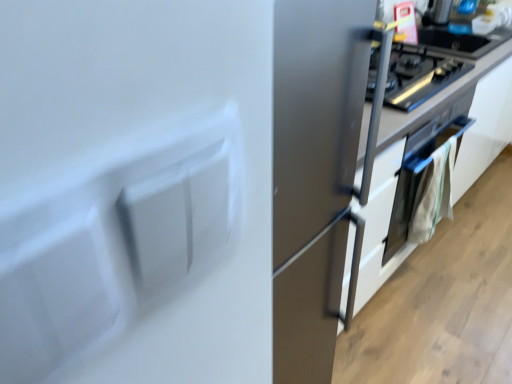
Describe the element at coordinates (418, 75) in the screenshot. This screenshot has height=384, width=512. I see `satin silver oven at upper right` at that location.

What is the approximate width of white matte refrigerator at center?

It is 33.46 centimeters.

This screenshot has height=384, width=512. Find the location of `satin silver oven at upper right`. satin silver oven at upper right is located at coordinates (418, 75).

Can you confirm if satin silver oven at upper right is taller than satin white cabinet at center?

Incorrect, the height of satin silver oven at upper right is not larger of that of satin white cabinet at center.

From the image's perspective, is satin silver oven at upper right on satin white cabinet at center?

Correct, satin silver oven at upper right appears higher than satin white cabinet at center in the image.

How many degrees apart are the facing directions of satin silver oven at upper right and satin white cabinet at center?

They differ by 0.683 degrees in their facing directions.

Which point is more forward, (424, 160) or (277, 294)?

The point (277, 294) is closer to the camera.

Is satin white cabinet at center at the back of satin silver oven at lower right?

That's right, satin silver oven at lower right is facing away from satin white cabinet at center.

In the scene shown: Can you confirm if satin silver oven at lower right is thinner than satin white cabinet at center?

Correct, the width of satin silver oven at lower right is less than that of satin white cabinet at center.

Consider the image. Considering the positions of objects satin silver oven at lower right and satin white cabinet at center in the image provided, who is more to the left, satin silver oven at lower right or satin white cabinet at center?

satin silver oven at lower right.

Is point (399, 215) positioned before point (278, 368)?

No.

Is satin silver oven at lower right facing towards white matte refrigerator at center?

No, satin silver oven at lower right is not aimed at white matte refrigerator at center.

Between satin silver oven at lower right and white matte refrigerator at center, which one appears on the left side from the viewer's perspective?

white matte refrigerator at center.

The width and height of the screenshot is (512, 384). I want to click on oven located on the left of satin white cabinet at center, so click(x=416, y=181).

Considering the sizes of satin white cabinet at center and satin silver oven at lower right in the image, is satin white cabinet at center wider or thinner than satin silver oven at lower right?

In the image, satin white cabinet at center appears to be wider than satin silver oven at lower right.

Considering the sizes of objects satin white cabinet at center and satin silver oven at lower right in the image provided, who is shorter, satin white cabinet at center or satin silver oven at lower right?

satin silver oven at lower right is shorter.

Which is more to the right, satin white cabinet at center or satin silver oven at lower right?

satin white cabinet at center is more to the right.

From the image's perspective, is satin white cabinet at center above white matte refrigerator at center?

Correct, satin white cabinet at center appears higher than white matte refrigerator at center in the image.

Is satin white cabinet at center bigger than white matte refrigerator at center?

Yes, satin white cabinet at center is bigger than white matte refrigerator at center.

Considering the relative positions of satin white cabinet at center and white matte refrigerator at center in the image provided, is satin white cabinet at center to the right of white matte refrigerator at center from the viewer's perspective?

Yes.

From the image's perspective, is white matte refrigerator at center positioned above or below satin white cabinet at center?

From the image's perspective, white matte refrigerator at center appears below satin white cabinet at center.

Which is more to the left, white matte refrigerator at center or satin white cabinet at center?

white matte refrigerator at center is more to the left.

Would you say white matte refrigerator at center contains satin white cabinet at center?

That's incorrect, satin white cabinet at center is not inside white matte refrigerator at center.

Could you tell me if satin silver oven at lower right is facing satin silver oven at upper right?

No, satin silver oven at lower right is not turned towards satin silver oven at upper right.

Does satin silver oven at lower right have a lesser width compared to satin silver oven at upper right?

Indeed, satin silver oven at lower right has a lesser width compared to satin silver oven at upper right.

Image resolution: width=512 pixels, height=384 pixels. Find the location of `home appliance located in front of the satin silver oven at lower right`. home appliance located in front of the satin silver oven at lower right is located at coordinates [x=418, y=75].

Looking at this image, do you think satin silver oven at lower right is within satin silver oven at upper right, or outside of it?

satin silver oven at lower right cannot be found inside satin silver oven at upper right.

I want to click on home appliance behind the satin white cabinet at center, so click(x=418, y=75).

Find the location of a particular element. cabinetry above the satin silver oven at lower right (from a real-world perspective) is located at coordinates (336, 173).

Estimate the real-world distances between objects in this image. Which object is closer to satin silver oven at lower right, white matte refrigerator at center or satin white cabinet at center?

Among the two, satin white cabinet at center is located nearer to satin silver oven at lower right.

Looking at the image, which one is located further to white matte refrigerator at center, satin silver oven at lower right or satin white cabinet at center?

satin silver oven at lower right.

Estimate the real-world distances between objects in this image. Which object is closer to satin silver oven at upper right, white matte refrigerator at center or satin silver oven at lower right?

satin silver oven at lower right.

From the image, which object appears to be nearer to satin silver oven at upper right, satin silver oven at lower right or white matte refrigerator at center?

satin silver oven at lower right is positioned closer to the anchor satin silver oven at upper right.

When comparing their distances from white matte refrigerator at center, does satin silver oven at upper right or satin silver oven at lower right seem further?

satin silver oven at lower right lies further to white matte refrigerator at center than the other object.

Estimate the real-world distances between objects in this image. Which object is further from satin silver oven at upper right, satin white cabinet at center or satin silver oven at lower right?

satin white cabinet at center lies further to satin silver oven at upper right than the other object.

In the scene shown: Based on their spatial positions, is satin silver oven at lower right or white matte refrigerator at center closer to satin white cabinet at center?

white matte refrigerator at center is positioned closer to the anchor satin white cabinet at center.

Considering their positions, is satin white cabinet at center positioned closer to white matte refrigerator at center than satin silver oven at lower right?

satin white cabinet at center is positioned closer to the anchor white matte refrigerator at center.

The width and height of the screenshot is (512, 384). Find the location of `cabinetry that lies between satin silver oven at upper right and satin silver oven at lower right from top to bottom`. cabinetry that lies between satin silver oven at upper right and satin silver oven at lower right from top to bottom is located at coordinates (336, 173).

At what (x,y) coordinates should I click in order to perform the action: click on cabinetry between white matte refrigerator at center and satin silver oven at lower right along the z-axis. Please return your answer as a coordinate pair (x, y). The width and height of the screenshot is (512, 384). Looking at the image, I should click on (336, 173).

The height and width of the screenshot is (384, 512). What are the coordinates of `home appliance between white matte refrigerator at center and satin silver oven at lower right from front to back` in the screenshot? It's located at (418, 75).

The image size is (512, 384). I want to click on cabinetry positioned between white matte refrigerator at center and satin silver oven at upper right from near to far, so click(336, 173).